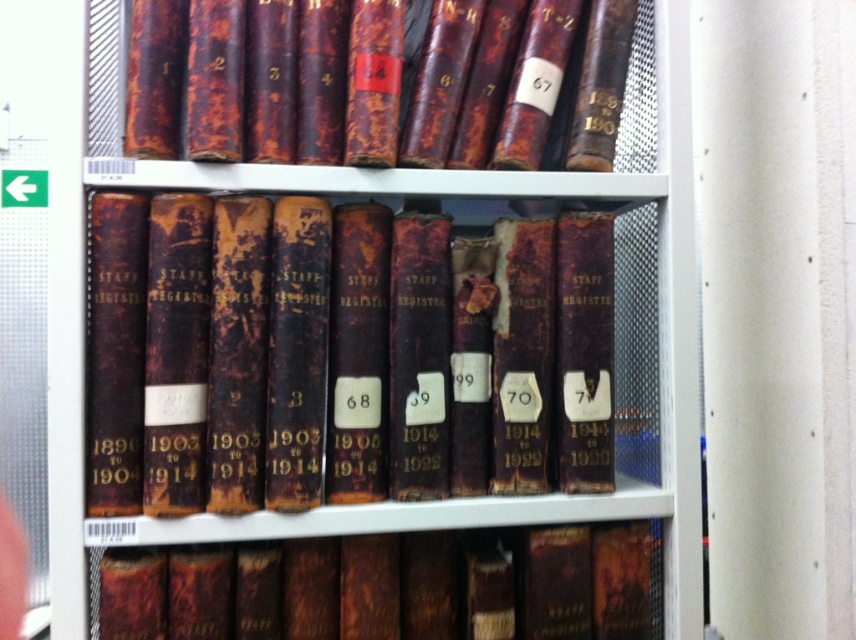
Between dark brown leather book at center and rusty leather book at center, which one is positioned higher?

dark brown leather book at center is above.

Is dark brown leather book at center smaller than rusty leather book at center?

Incorrect, dark brown leather book at center is not smaller in size than rusty leather book at center.

Is point (510, 304) positioned in front of point (128, 612)?

No.

The width and height of the screenshot is (856, 640). I want to click on dark brown leather book at center, so click(397, 362).

Locate an element on the screen. The image size is (856, 640). dark brown leather book at center is located at coordinates (397, 362).

Who is lower down, dark brown leather book at center or rusty leather book at upper center?

Positioned lower is dark brown leather book at center.

Is point (587, 305) closer to camera compared to point (480, 0)?

No, (587, 305) is behind (480, 0).

Image resolution: width=856 pixels, height=640 pixels. I want to click on dark brown leather book at center, so click(x=397, y=362).

Is point (343, 33) positioned after point (578, 525)?

No, (343, 33) is closer to viewer.

Which is more to the left, rusty leather book at upper center or rusty leather book at center?

rusty leather book at upper center is more to the left.

Measure the distance between rusty leather book at upper center and camera.

A distance of 31.66 inches exists between rusty leather book at upper center and camera.

Image resolution: width=856 pixels, height=640 pixels. Identify the location of rusty leather book at upper center. (379, 83).